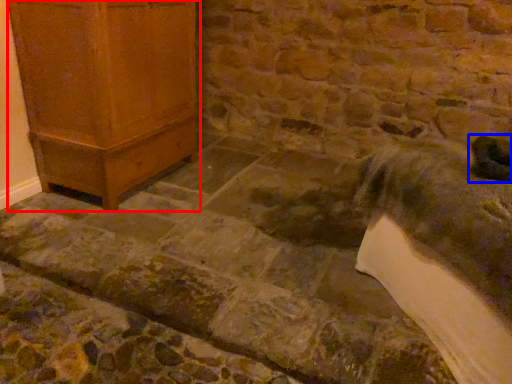
Question: Among these objects, which one is nearest to the camera, furniture (highlighted by a red box) or animal (highlighted by a blue box)?

Choices:
 (A) furniture
 (B) animal

Answer: (B)